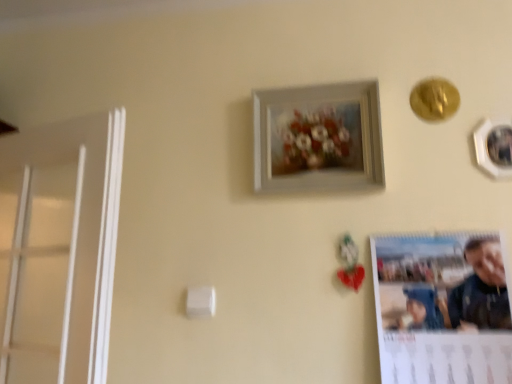
Question: From a real-world perspective, is white matte picture frame at upper center, acting as the 2th picture frame starting from the right, physically located above or below matte paper calendar at lower right?

Choices:
 (A) above
 (B) below

Answer: (A)

Question: Is point (373, 173) closer or farther from the camera than point (410, 264)?

Choices:
 (A) farther
 (B) closer

Answer: (A)

Question: Estimate the real-world distances between objects in this image. Which object is farther from the white matte picture frame at upper center, the first picture frame in the left-to-right sequence?

Choices:
 (A) matte paper calendar at lower right
 (B) white glossy picture frame at upper right, placed as the first picture frame when sorted from right to left

Answer: (B)

Question: Which object is the farthest from the white glossy picture frame at upper right, placed as the first picture frame when sorted from right to left?

Choices:
 (A) matte paper calendar at lower right
 (B) white matte picture frame at upper center, the first picture frame in the left-to-right sequence

Answer: (B)